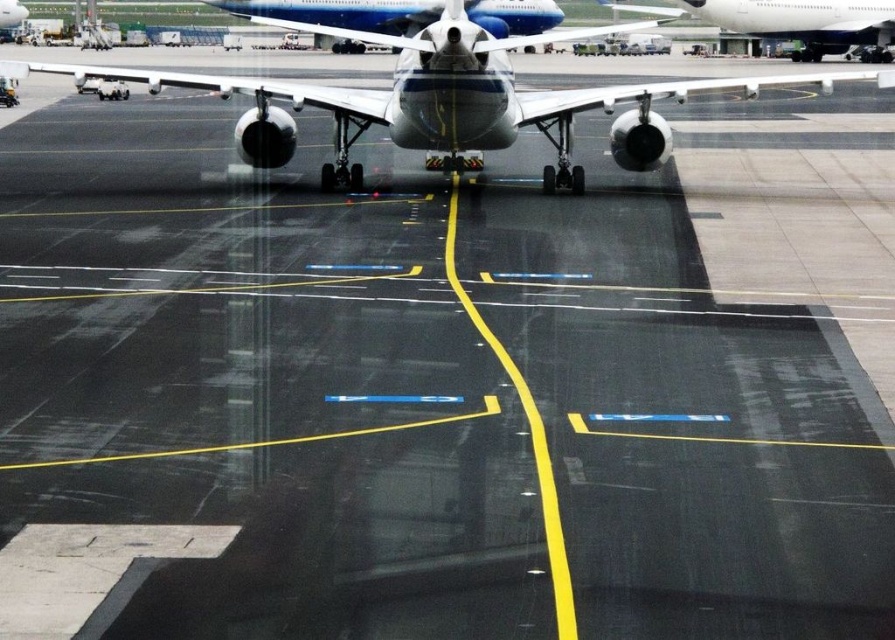
You are a ground crew member at the airport. You need to move a luggage cart that is 2 meters wide from the metallic gray airplane at center to the white glossy airplane at upper right. Is there enough space between them for the cart to pass through?

The metallic gray airplane at center is 12.80 meters away from the white glossy airplane at upper right. Since the luggage cart is only 2 meters wide, there is sufficient space for it to pass through the 12.80 meter gap between the two airplanes.

You are a pilot who needs to park your metallic gray airplane at center precisely at the designated parking spot located at point coordinates of 0.156, 0.497. Based on the scene, can you confirm if your current position matches the required coordinates?

Yes, the metallic gray airplane at center is already positioned at the exact coordinates of [444,99], so it is correctly parked at the designated parking spot.